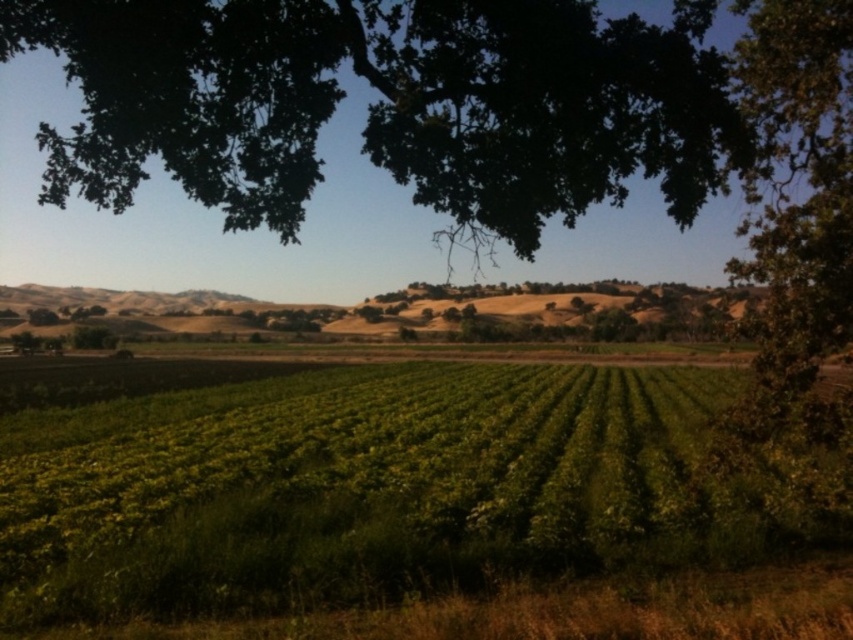
Question: Which of the following is the closest to the observer?

Choices:
 (A) green leafy tree at upper right
 (B) green leafy field at center

Answer: (B)

Question: Which of the following is the farthest from the observer?

Choices:
 (A) (660, 624)
 (B) (734, 429)
 (C) (338, 28)

Answer: (B)

Question: Does green leafy field at center have a greater width compared to green leafy tree at upper center?

Choices:
 (A) no
 (B) yes

Answer: (A)

Question: Does green leafy field at center appear under green leafy tree at upper right?

Choices:
 (A) no
 (B) yes

Answer: (B)

Question: Estimate the real-world distances between objects in this image. Which object is closer to the green leafy field at center?

Choices:
 (A) green leafy tree at upper right
 (B) green leafy tree at upper center

Answer: (A)

Question: Is the position of green leafy field at center less distant than that of green leafy tree at upper center?

Choices:
 (A) no
 (B) yes

Answer: (B)